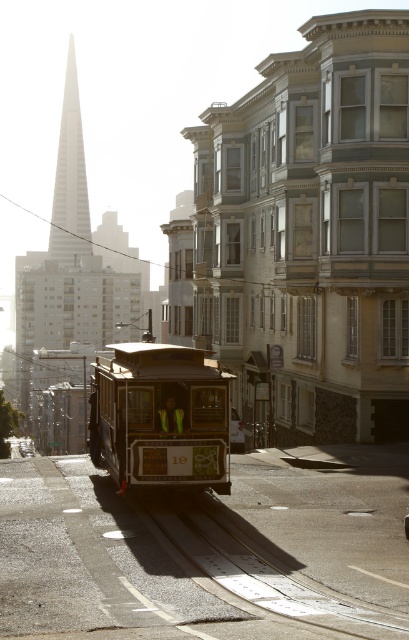
Question: Which point appears farthest from the camera in this image?

Choices:
 (A) (159, 492)
 (B) (81, 228)
 (C) (235, 445)
 (D) (128, 408)

Answer: (B)

Question: Considering the relative positions of white glass spire at upper center and metallic silver car at center in the image provided, where is white glass spire at upper center located with respect to metallic silver car at center?

Choices:
 (A) right
 (B) left

Answer: (B)

Question: Which point is farther to the camera?

Choices:
 (A) (76, 248)
 (B) (238, 445)
 (C) (168, 444)
 (D) (400, 634)

Answer: (A)

Question: Does metal/smooth track at center lie in front of white glass spire at upper center?

Choices:
 (A) yes
 (B) no

Answer: (A)

Question: Among these points, which one is farthest from the camera?

Choices:
 (A) (233, 451)
 (B) (145, 394)
 (C) (72, 253)
 (D) (280, 596)

Answer: (C)

Question: Is metal/smooth track at center positioned behind white glass spire at upper center?

Choices:
 (A) no
 (B) yes

Answer: (A)